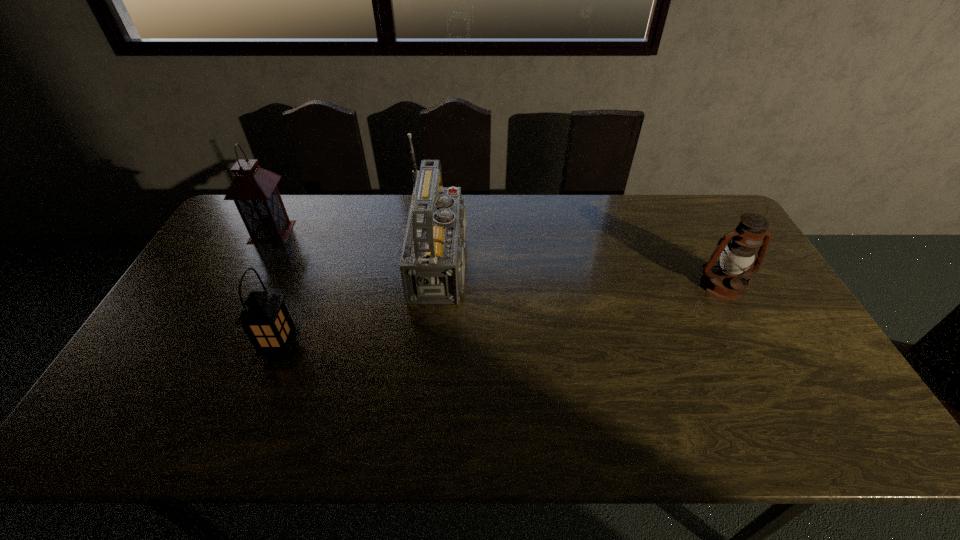
Locate an element on the screen. The image size is (960, 540). free space located on the right of the nearest object is located at coordinates (441, 349).

Locate an element on the screen. This screenshot has height=540, width=960. radio receiver that is positioned at the far edge is located at coordinates (432, 265).

Where is `lantern at the far edge`? This screenshot has width=960, height=540. lantern at the far edge is located at coordinates (254, 190).

Identify the location of object situated at the left edge. Image resolution: width=960 pixels, height=540 pixels. (254, 190).

Find the location of a particular element. Image resolution: width=960 pixels, height=540 pixels. object at the right edge is located at coordinates (727, 281).

You are a GUI agent. You are given a task and a screenshot of the screen. Output one action in this format:
    pyautogui.click(x=<x>, y=<y>)
    Task: Click on the object that is at the far left corner
    This screenshot has height=540, width=960.
    Given the screenshot: What is the action you would take?
    pyautogui.click(x=254, y=190)

Find the location of `vacant area at the far edge`. vacant area at the far edge is located at coordinates (652, 209).

Locate an element on the screen. This screenshot has height=540, width=960. vacant space at the near edge of the desktop is located at coordinates (765, 435).

Identify the location of blank area at the left edge. (229, 303).

This screenshot has width=960, height=540. Find the location of `vacant space at the far right corner`. vacant space at the far right corner is located at coordinates (693, 210).